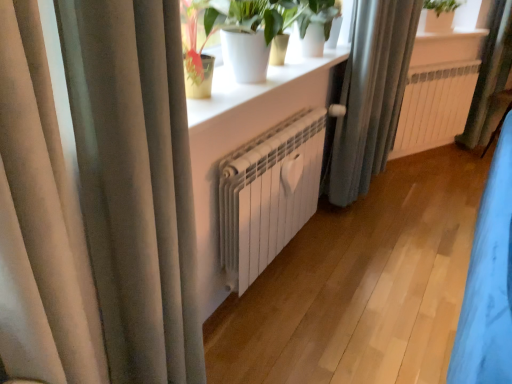
The height and width of the screenshot is (384, 512). I want to click on free spot below white matte radiator at center, marked as the 2th radiator in a front-to-back arrangement (from a real-world perspective), so click(424, 161).